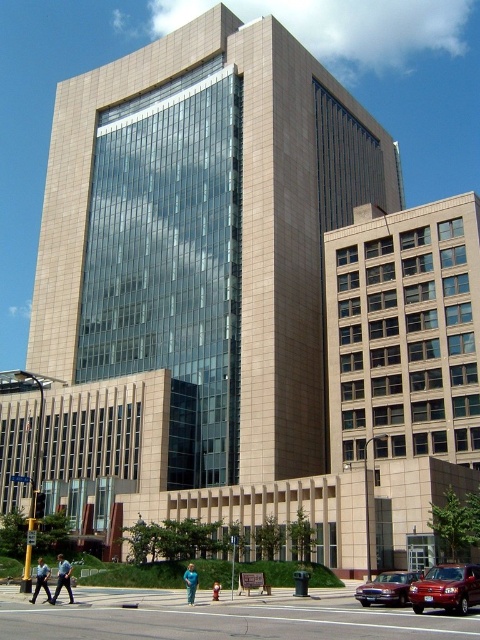
Is point (380, 582) behind point (217, 582)?

That is False.

Does point (359, 586) come behind point (215, 582)?

Yes, it is.

The width and height of the screenshot is (480, 640). What are the coordinates of `shiny maroon sedan at lower right` in the screenshot? It's located at (386, 588).

Who is taller, blue fabric person at lower center or green fabric person at center?

With more height is blue fabric person at lower center.

Can you confirm if blue fabric person at lower center is wider than green fabric person at center?

Yes, blue fabric person at lower center is wider than green fabric person at center.

In order to click on blue fabric person at lower center in this screenshot , I will do `click(191, 582)`.

The height and width of the screenshot is (640, 480). Identify the location of shiny red car at lower right. (446, 588).

Can you confirm if shiny red car at lower right is taller than dark blue uniform at lower left?

No, shiny red car at lower right is not taller than dark blue uniform at lower left.

Does point (466, 608) come closer to viewer compared to point (66, 573)?

Yes, it is.

You are a GUI agent. You are given a task and a screenshot of the screen. Output one action in this format:
    pyautogui.click(x=<x>, y=<y>)
    Task: Click on the shiny red car at lower right
    The height and width of the screenshot is (640, 480).
    Given the screenshot: What is the action you would take?
    pyautogui.click(x=446, y=588)